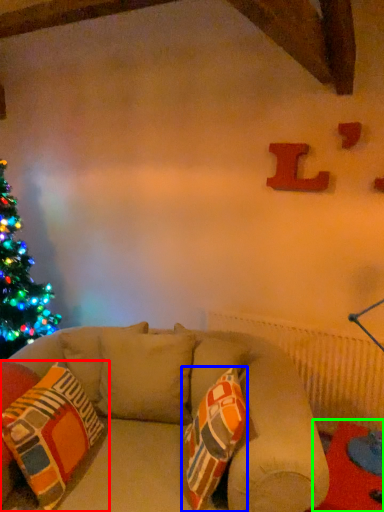
Question: Estimate the real-world distances between objects in this image. Which object is closer to pillow (highlighted by a red box), throw pillow (highlighted by a blue box) or table (highlighted by a green box)?

Choices:
 (A) throw pillow
 (B) table

Answer: (A)